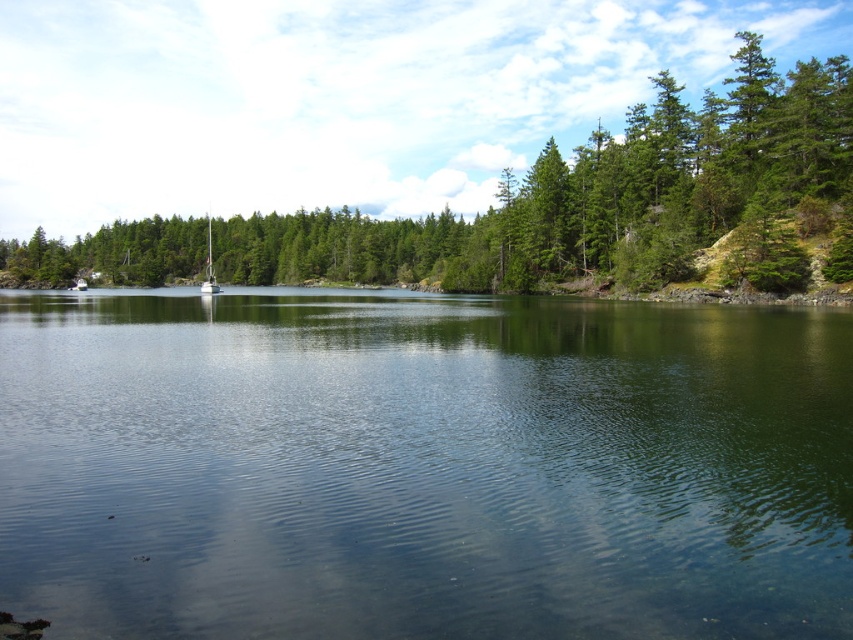
You are standing on the lakeside and want to take a photo of both the clear water at center and the green matte tree at center. Which object should you adjust your camera to focus on first if you want to capture both in the same frame?

You should focus on the clear water at center first because it is positioned to the left of the green matte tree at center, so adjusting the camera to include the leftmost object ensures both are in the frame.

You are standing on the lakeshore and see the clear water at center and the white glossy sailboat at center. Which object is positioned to the right of the other?

The clear water at center is to the right of the white glossy sailboat at center.